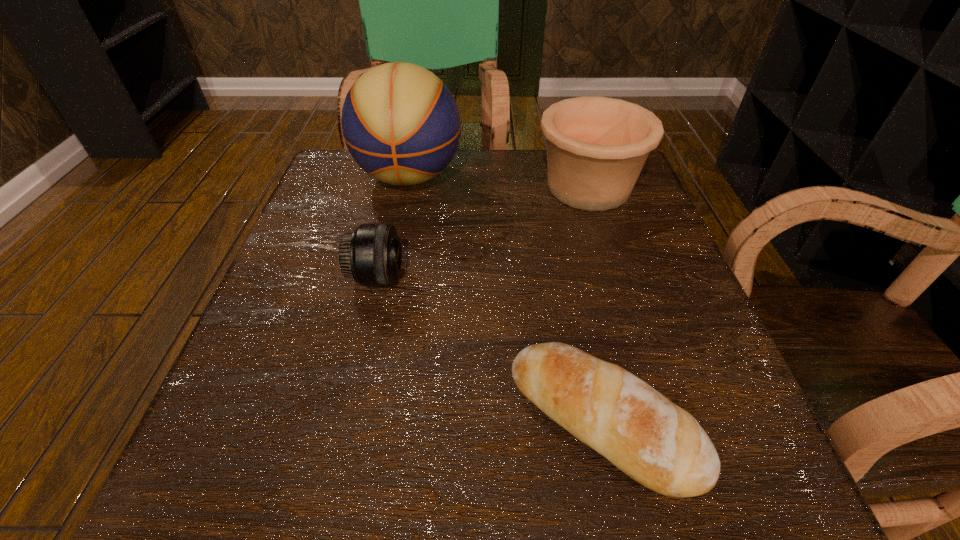
In order to click on vacant region at the far edge in this screenshot , I will do `click(420, 188)`.

Where is `free region at the left edge`? This screenshot has width=960, height=540. free region at the left edge is located at coordinates pyautogui.click(x=352, y=231).

The width and height of the screenshot is (960, 540). I want to click on free region at the right edge of the desktop, so click(599, 217).

The width and height of the screenshot is (960, 540). In the image, there is a desktop. Identify the location of blank space at the far left corner. (367, 174).

Where is `vacant space at the near right corner of the desktop`? This screenshot has height=540, width=960. vacant space at the near right corner of the desktop is located at coordinates (788, 503).

In order to click on free spot between the pottery and the basketball in this screenshot , I will do `click(499, 182)`.

The height and width of the screenshot is (540, 960). In order to click on vacant point located between the shortest object and the third farthest object in this screenshot , I will do `click(490, 349)`.

You are a GUI agent. You are given a task and a screenshot of the screen. Output one action in this format:
    pyautogui.click(x=<x>, y=<y>)
    Task: Click on the vacant area that lies between the nearest object and the telephoto lens
    
    Given the screenshot: What is the action you would take?
    pyautogui.click(x=490, y=349)

Locate an element on the screen. This screenshot has height=540, width=960. unoccupied position between the second tallest object and the tallest object is located at coordinates (499, 182).

Where is `free space that is in between the pottery and the nearest object`? This screenshot has height=540, width=960. free space that is in between the pottery and the nearest object is located at coordinates (595, 304).